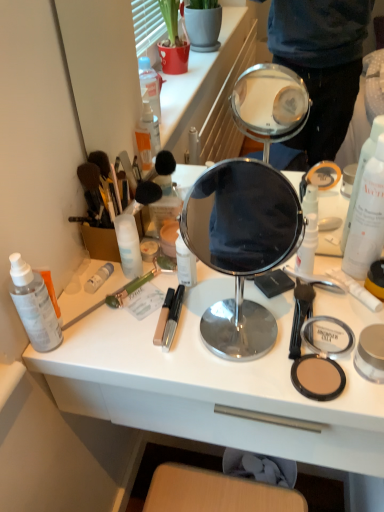
Locate an element on the screen. Image resolution: width=384 pixels, height=512 pixels. vacant area that lies between transparent plastic spray bottle at left, the 1th toiletry when ordered from left to right, and white matte pump bottle at right, which ranks as the 2th toiletry in right-to-left order is located at coordinates (177, 308).